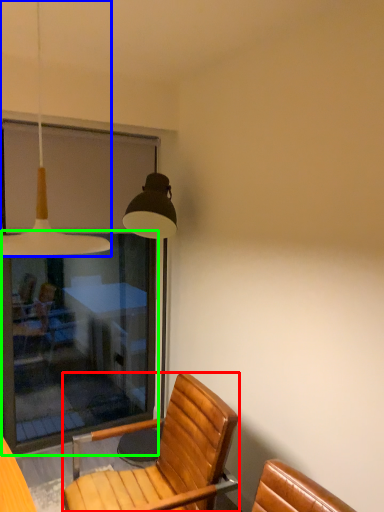
Question: Which object is positioned closest to chair (highlighted by a red box)? Select from lamp (highlighted by a blue box) and screen door (highlighted by a green box).

Choices:
 (A) lamp
 (B) screen door

Answer: (A)